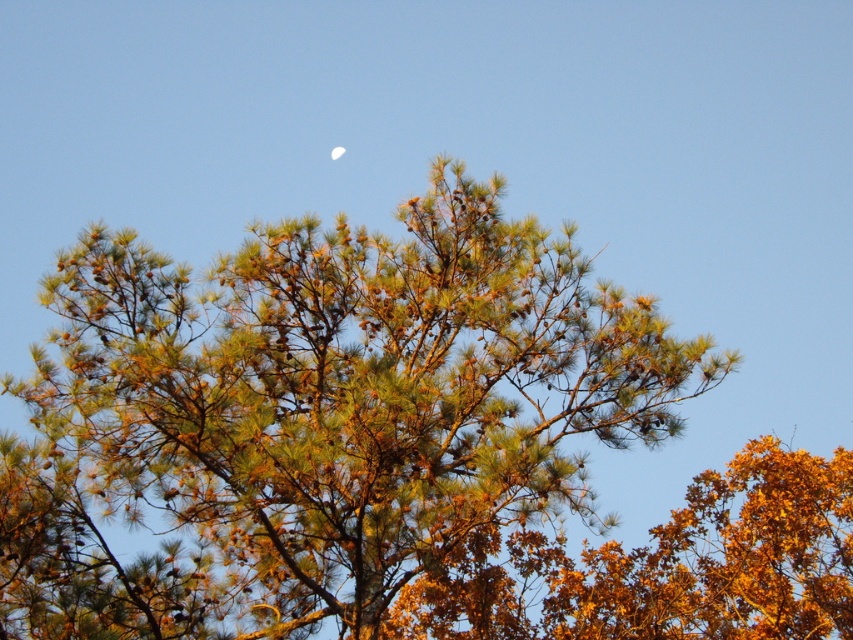
Based on the scene description, what is located at the coordinates point [316,416]?

The coordinates point [316,416] is occupied by green needle like at center.